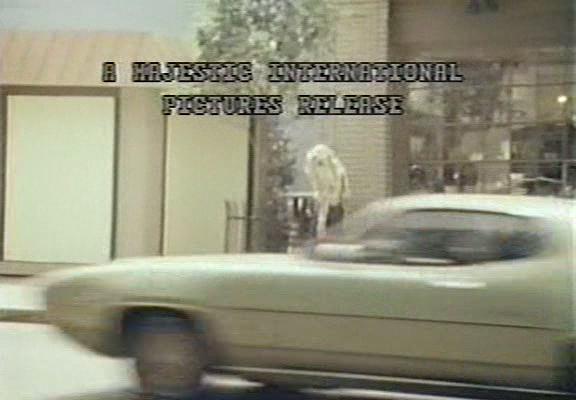
The height and width of the screenshot is (400, 576). Find the location of `mirror`. mirror is located at coordinates (363, 256).